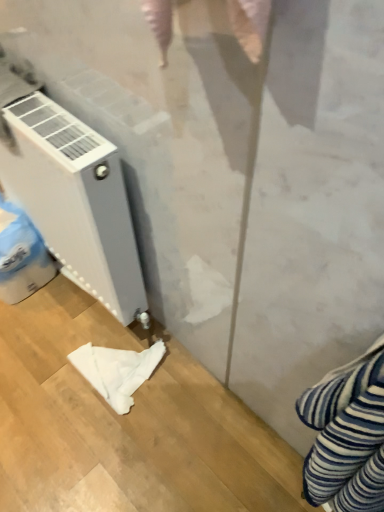
This screenshot has width=384, height=512. Find the location of `white soft cloth at lower left`. white soft cloth at lower left is located at coordinates (117, 371).

Describe the element at coordinates (117, 371) in the screenshot. I see `white soft cloth at lower left` at that location.

What is the approximate width of white matte radiator at left?

white matte radiator at left is 5.84 inches wide.

Where is `white matte radiator at left`? The width and height of the screenshot is (384, 512). white matte radiator at left is located at coordinates (75, 200).

Describe the element at coordinates (75, 200) in the screenshot. I see `white matte radiator at left` at that location.

Locate an element on the screen. This screenshot has width=384, height=512. white soft cloth at lower left is located at coordinates [117, 371].

Looking at this image, which object is positioned more to the right, white matte radiator at left or white soft cloth at lower left?

From the viewer's perspective, white soft cloth at lower left appears more on the right side.

Considering the relative positions of white matte radiator at left and white soft cloth at lower left in the image provided, is white matte radiator at left behind white soft cloth at lower left?

That is False.

Does point (111, 211) lie behind point (109, 388)?

No, (111, 211) is in front of (109, 388).

From the image's perspective, which object appears higher, white matte radiator at left or white soft cloth at lower left?

white matte radiator at left appears higher in the image.

From a real-world perspective, is white matte radiator at left positioned above or below white soft cloth at lower left?

In terms of real-world spatial position, white matte radiator at left is above white soft cloth at lower left.

Is white matte radiator at left wider than white soft cloth at lower left?

Incorrect, the width of white matte radiator at left does not surpass that of white soft cloth at lower left.

Is white matte radiator at left shorter than white soft cloth at lower left?

No.

Considering the sizes of objects white matte radiator at left and white soft cloth at lower left in the image provided, who is bigger, white matte radiator at left or white soft cloth at lower left?

With larger size is white matte radiator at left.

In the scene shown: Is white soft cloth at lower left completely or partially inside white matte radiator at left?

No.

Is white matte radiator at left beside white soft cloth at lower left?

No.

Does white matte radiator at left turn towards white soft cloth at lower left?

Yes, white matte radiator at left is oriented towards white soft cloth at lower left.

There is a white soft cloth at lower left. Where is `home appliance above it (from a real-world perspective)`? The height and width of the screenshot is (512, 384). home appliance above it (from a real-world perspective) is located at coordinates (75, 200).

Considering the positions of objects white soft cloth at lower left and white matte radiator at left in the image provided, who is more to the right, white soft cloth at lower left or white matte radiator at left?

white soft cloth at lower left is more to the right.

Considering the relative positions of white soft cloth at lower left and white matte radiator at left in the image provided, is white soft cloth at lower left behind white matte radiator at left?

Yes, white soft cloth at lower left is further from the viewer.

Considering the positions of point (101, 359) and point (105, 290), is point (101, 359) closer or farther from the camera than point (105, 290)?

Clearly, point (101, 359) is more distant from the camera than point (105, 290).

From the image's perspective, is white soft cloth at lower left positioned above or below white matte radiator at left?

Based on their image positions, white soft cloth at lower left is located beneath white matte radiator at left.

From a real-world perspective, between white soft cloth at lower left and white matte radiator at left, who is vertically higher?

From a 3D spatial view, white matte radiator at left is above.

Considering the sizes of objects white soft cloth at lower left and white matte radiator at left in the image provided, who is wider, white soft cloth at lower left or white matte radiator at left?

Wider between the two is white soft cloth at lower left.

From their relative heights in the image, would you say white soft cloth at lower left is taller or shorter than white matte radiator at left?

white soft cloth at lower left is shorter than white matte radiator at left.

Is white soft cloth at lower left bigger than white matte radiator at left?

Incorrect, white soft cloth at lower left is not larger than white matte radiator at left.

Would you say white soft cloth at lower left is outside white matte radiator at left?

white soft cloth at lower left is positioned outside white matte radiator at left.

Is white soft cloth at lower left in contact with white matte radiator at left?

No, white soft cloth at lower left is not with white matte radiator at left.

Is white soft cloth at lower left oriented away from white matte radiator at left?

Yes, white matte radiator at left is at the back of white soft cloth at lower left.

What's the angular difference between white soft cloth at lower left and white matte radiator at left's facing directions?

The angular difference between white soft cloth at lower left and white matte radiator at left is 4.5 degrees.

This screenshot has height=512, width=384. What are the coordinates of `cloth that appears on the right of white matte radiator at left` in the screenshot? It's located at (117, 371).

The height and width of the screenshot is (512, 384). What are the coordinates of `home appliance above the white soft cloth at lower left (from a real-world perspective)` in the screenshot? It's located at (75, 200).

This screenshot has width=384, height=512. I want to click on cloth behind the white matte radiator at left, so click(x=117, y=371).